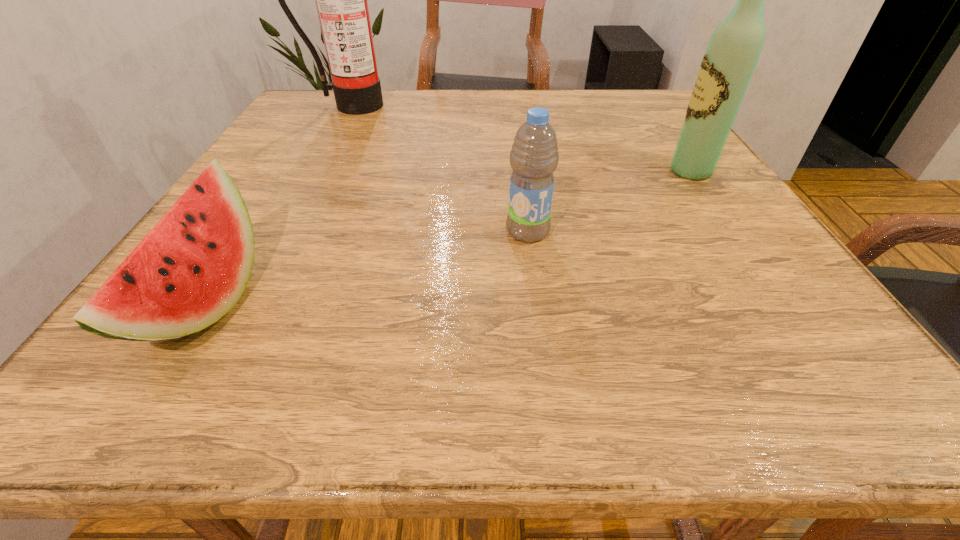
Where is `object that can be found as the third closest to the shortest object`? object that can be found as the third closest to the shortest object is located at coordinates (729, 61).

In order to click on object that is the second closest one to the fire extinguisher in this screenshot , I will do `click(534, 156)`.

You are a GUI agent. You are given a task and a screenshot of the screen. Output one action in this format:
    pyautogui.click(x=<x>, y=<y>)
    Task: Click on the vacant space that satisfies the following two spatial constraints: 1. on the front-facing side of the farthest object; 2. on the outer rind of the watermelon
    The image size is (960, 540).
    Given the screenshot: What is the action you would take?
    pyautogui.click(x=241, y=304)

You are a GUI agent. You are given a task and a screenshot of the screen. Output one action in this format:
    pyautogui.click(x=<x>, y=<y>)
    Task: Click on the vacant position in the image that satisfies the following two spatial constraints: 1. on the front-facing side of the fire extinguisher; 2. on the left side of the second object from right to left
    
    Given the screenshot: What is the action you would take?
    pyautogui.click(x=280, y=232)

You are a GUI agent. You are given a task and a screenshot of the screen. Output one action in this format:
    pyautogui.click(x=<x>, y=<y>)
    Task: Click on the free spot that satisfies the following two spatial constraints: 1. on the front-facing side of the water bottle; 2. on the left side of the fire extinguisher
    Image resolution: width=960 pixels, height=540 pixels.
    Given the screenshot: What is the action you would take?
    pyautogui.click(x=280, y=232)

The image size is (960, 540). In order to click on free spot that satisfies the following two spatial constraints: 1. on the front-facing side of the fire extinguisher; 2. on the outer rind of the shortest object in this screenshot , I will do `click(241, 304)`.